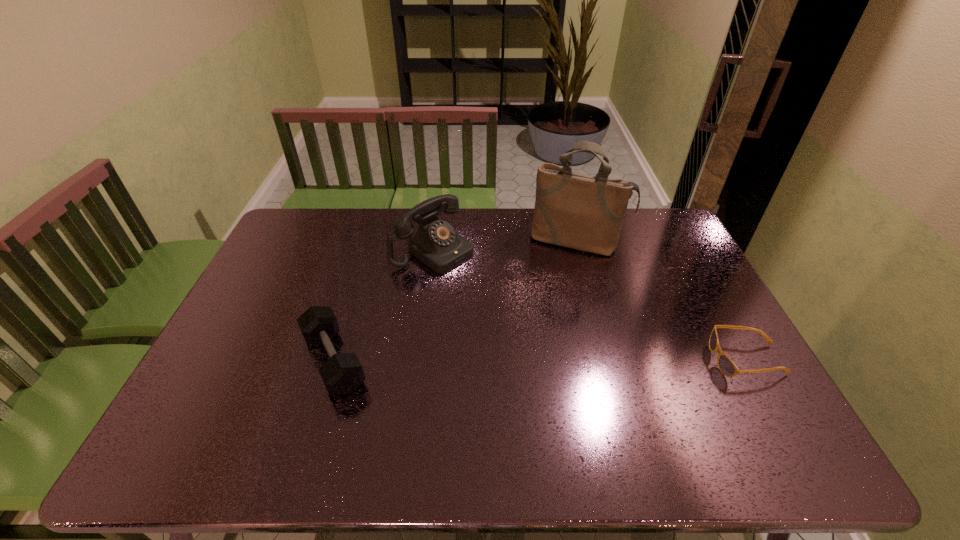
You are a GUI agent. You are given a task and a screenshot of the screen. Output one action in this format:
    pyautogui.click(x=<x>, y=<y>)
    Task: Click on the free space between the dumbbell and the telephone
    Image resolution: width=960 pixels, height=540 pixels.
    Given the screenshot: What is the action you would take?
    pyautogui.click(x=384, y=306)

I want to click on unoccupied area between the sunglasses and the second object from right to left, so click(662, 300).

Locate an element on the screen. vacant space that is in between the telephone and the second object from right to left is located at coordinates (505, 245).

Locate an element on the screen. Image resolution: width=960 pixels, height=540 pixels. unoccupied area between the sunglasses and the third tallest object is located at coordinates (540, 360).

The image size is (960, 540). I want to click on empty space that is in between the third object from left to right and the rightmost object, so click(x=662, y=300).

Identify the location of blank region between the tallest object and the third tallest object. (456, 301).

Find the location of a particular element. free point between the tallest object and the rightmost object is located at coordinates (662, 300).

Locate which object is the second closest to the second shortest object. Please provide its 2D coordinates. Your answer should be formatted as a tuple, i.e. [(x, y)], where the tuple contains the x and y coordinates of a point satisfying the conditions above.

[(578, 211)]

I want to click on object identified as the second closest to the dumbbell, so click(x=578, y=211).

Locate an element on the screen. This screenshot has height=540, width=960. free location that satisfies the following two spatial constraints: 1. on the back side of the shortest object; 2. on the front-facing side of the third tallest object is located at coordinates (335, 360).